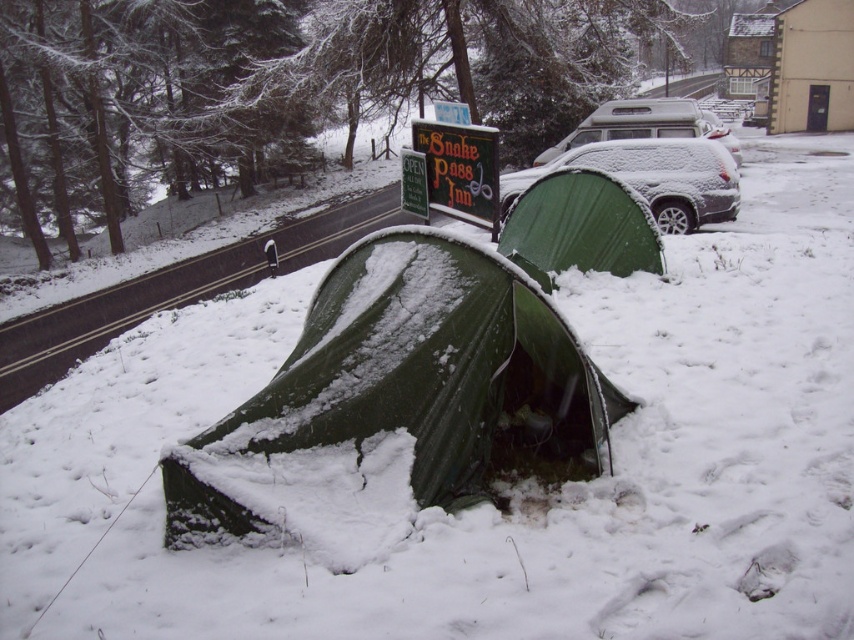
Question: Considering the real-world distances, which object is farthest from the green painted wood sign at center?

Choices:
 (A) green wooden signboard at center
 (B) green tarpaulin tent at center

Answer: (B)

Question: Does snow-covered suv at center appear under snow-covered suv at upper right?

Choices:
 (A) yes
 (B) no

Answer: (A)

Question: Which is nearer to the green wooden signboard at center?

Choices:
 (A) snow-covered suv at center
 (B) green painted wood sign at center
 (C) green tarpaulin tent at center
 (D) green fabric tent at center

Answer: (B)

Question: Can you confirm if green fabric tent at center is positioned to the left of snow-covered suv at upper right?

Choices:
 (A) no
 (B) yes

Answer: (B)

Question: Can you confirm if green fabric tent at center is positioned below green wooden signboard at center?

Choices:
 (A) no
 (B) yes

Answer: (B)

Question: Which of these objects is positioned closest to the green fabric tent at center?

Choices:
 (A) snow-covered suv at center
 (B) green painted wood sign at center
 (C) green tarpaulin tent at center
 (D) green wooden signboard at center

Answer: (B)